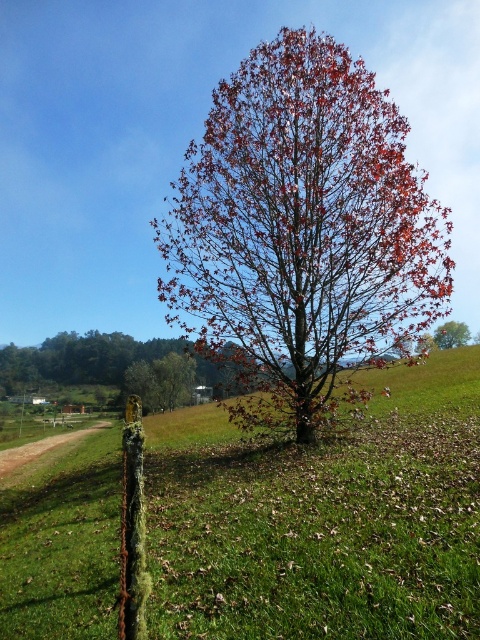
You are a gardener who wants to plant a new flower bed between the green grassy at center and the smooth brown tree at center. Which area should you choose if you want the flowers to be taller than the tree?

The green grassy at center has a greater height compared to the smooth brown tree at center, so planting the flower bed in the green grassy at center area would ensure the flowers are taller than the tree.

You are standing at the edge of the scene and want to walk towards the smooth brown tree at center. Which direction should you move relative to the green grassy at center?

To reach the smooth brown tree at center, you should move to the right of the green grassy at center since the green grassy at center is located to its left.